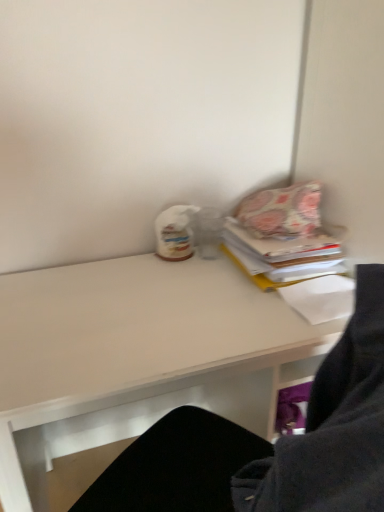
You are a GUI agent. You are given a task and a screenshot of the screen. Output one action in this format:
    pyautogui.click(x=<x>, y=<y>)
    Task: Click on the free point above white matte desk at center (from a real-world perspective)
    The width and height of the screenshot is (384, 512).
    Given the screenshot: What is the action you would take?
    pyautogui.click(x=180, y=304)